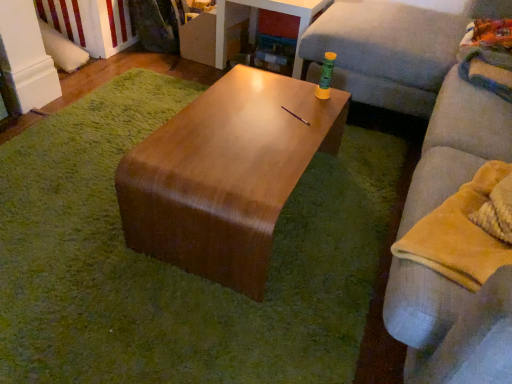
This screenshot has height=384, width=512. Describe the element at coordinates (256, 23) in the screenshot. I see `wooden table at center` at that location.

At what (x,y) coordinates should I click in order to perform the action: click on wooden table at center. Please return your answer as a coordinate pair (x, y). The width and height of the screenshot is (512, 384). Looking at the image, I should click on (178, 269).

What is the approximate width of light gray fabric couch at right?

light gray fabric couch at right is 19.29 inches wide.

The image size is (512, 384). In order to click on wooden table at center in this screenshot , I will do (256, 23).

How different are the orientations of yellow fleece blanket at right and light gray fabric couch at right in degrees?

They differ by 0.000386 degrees in their facing directions.

In the image, is yellow fleece blanket at right positioned in front of or behind light gray fabric couch at right?

Visually, yellow fleece blanket at right is located behind light gray fabric couch at right.

Considering the points (489, 244) and (502, 358), which point is in front, point (489, 244) or point (502, 358)?

Positioned in front is point (502, 358).

At what (x,y) coordinates should I click in order to perform the action: click on studio couch located above the yellow fleece blanket at right (from the image's perspective). Please return your answer as a coordinate pair (x, y). Image resolution: width=512 pixels, height=384 pixels. Looking at the image, I should click on (450, 326).

Can you confirm if wooden table at center is taller than light gray fabric couch at right?

No.

Is point (225, 43) farther from viewer compared to point (429, 370)?

Yes, it is behind point (429, 370).

Who is smaller, wooden table at center or light gray fabric couch at right?

wooden table at center.

Is wooden table at center taller or shorter than yellow fleece blanket at right?

wooden table at center is taller than yellow fleece blanket at right.

Is point (281, 5) less distant than point (500, 255)?

That is False.

Based on the photo, could you tell me if wooden table at center is facing yellow fleece blanket at right?

No, wooden table at center is not aimed at yellow fleece blanket at right.

Is wooden table at center outside of yellow fleece blanket at right?

Yes.

Between wooden table at center and wooden table at center, which one is positioned in front?

wooden table at center is closer to the camera.

Which of these two, wooden table at center or wooden table at center, is thinner?

With smaller width is wooden table at center.

Is wooden table at center with wooden table at center?

wooden table at center is not next to wooden table at center, and they're not touching.

Where is `table located above the wooden table at center (from a real-world perspective)`? This screenshot has height=384, width=512. table located above the wooden table at center (from a real-world perspective) is located at coordinates (256, 23).

Measure the distance from shiny brown coffee table at center to light gray fabric couch at right.

shiny brown coffee table at center is 21.67 inches from light gray fabric couch at right.

From a real-world perspective, which is physically above, shiny brown coffee table at center or light gray fabric couch at right?

light gray fabric couch at right is physically above.

Which is behind, point (287, 78) or point (428, 127)?

Point (428, 127)

Does shiny brown coffee table at center have a greater height compared to light gray fabric couch at right?

No, shiny brown coffee table at center is not taller than light gray fabric couch at right.

Does yellow fleece blanket at right touch shiny brown coffee table at center?

yellow fleece blanket at right is not next to shiny brown coffee table at center, and they're not touching.

Is yellow fleece blanket at right inside or outside of shiny brown coffee table at center?

yellow fleece blanket at right is not inside shiny brown coffee table at center, it's outside.

From a real-world perspective, who is located higher, yellow fleece blanket at right or shiny brown coffee table at center?

yellow fleece blanket at right.

Is yellow fleece blanket at right completely or partially inside wooden table at center?

No, wooden table at center does not contain yellow fleece blanket at right.

From a real-world perspective, is wooden table at center above or below yellow fleece blanket at right?

Clearly, from a real-world perspective, wooden table at center is below yellow fleece blanket at right.

Between wooden table at center and yellow fleece blanket at right, which one is positioned behind?

wooden table at center is further away from the camera.

Can you confirm if wooden table at center is shorter than yellow fleece blanket at right?

Indeed, wooden table at center has a lesser height compared to yellow fleece blanket at right.

This screenshot has height=384, width=512. Find the location of `studio couch that is above the yellow fleece blanket at right (from the image's perspective)`. studio couch that is above the yellow fleece blanket at right (from the image's perspective) is located at coordinates (450, 326).

Identify the location of studio couch that appears on the right of wooden table at center. Image resolution: width=512 pixels, height=384 pixels. (450, 326).

When comparing their distances from wooden table at center, does wooden table at center or yellow fleece blanket at right seem further?

Based on the image, yellow fleece blanket at right appears to be further to wooden table at center.

Which object lies further to the anchor point light gray fabric couch at right, shiny brown coffee table at center or wooden table at center?

wooden table at center lies further to light gray fabric couch at right than the other object.

When comparing their distances from yellow fleece blanket at right, does light gray fabric couch at right or wooden table at center seem closer?

The object closer to yellow fleece blanket at right is light gray fabric couch at right.

Based on their spatial positions, is wooden table at center or yellow fleece blanket at right further from shiny brown coffee table at center?

yellow fleece blanket at right is positioned further to the anchor shiny brown coffee table at center.

Considering their positions, is shiny brown coffee table at center positioned further to wooden table at center than light gray fabric couch at right?

Based on the image, light gray fabric couch at right appears to be further to wooden table at center.

When comparing their distances from light gray fabric couch at right, does yellow fleece blanket at right or wooden table at center seem further?

wooden table at center.

Based on their spatial positions, is light gray fabric couch at right or wooden table at center closer to wooden table at center?

Among the two, wooden table at center is located nearer to wooden table at center.

Estimate the real-world distances between objects in this image. Which object is closer to wooden table at center, wooden table at center or light gray fabric couch at right?

The object closer to wooden table at center is wooden table at center.

This screenshot has width=512, height=384. Identify the location of mat positioned between light gray fabric couch at right and wooden table at center from near to far. (178, 269).

Identify the location of coffee table situated between wooden table at center and light gray fabric couch at right from left to right. (225, 175).

Where is `material between light gray fabric couch at right and wooden table at center in the front-back direction`? Image resolution: width=512 pixels, height=384 pixels. material between light gray fabric couch at right and wooden table at center in the front-back direction is located at coordinates (458, 234).

What are the coordinates of `coffee table positioned between light gray fabric couch at right and wooden table at center from near to far` in the screenshot? It's located at (225, 175).